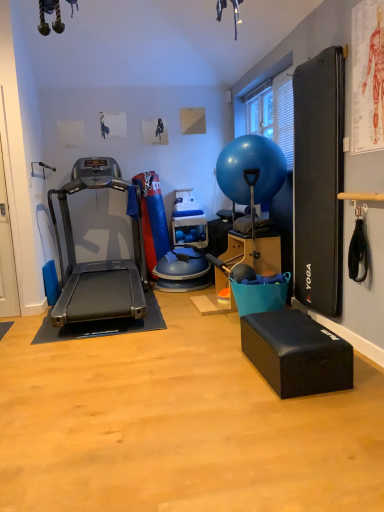
In order to click on vacant space situated on the left part of black foam footrest at lower right in this screenshot , I will do `click(218, 382)`.